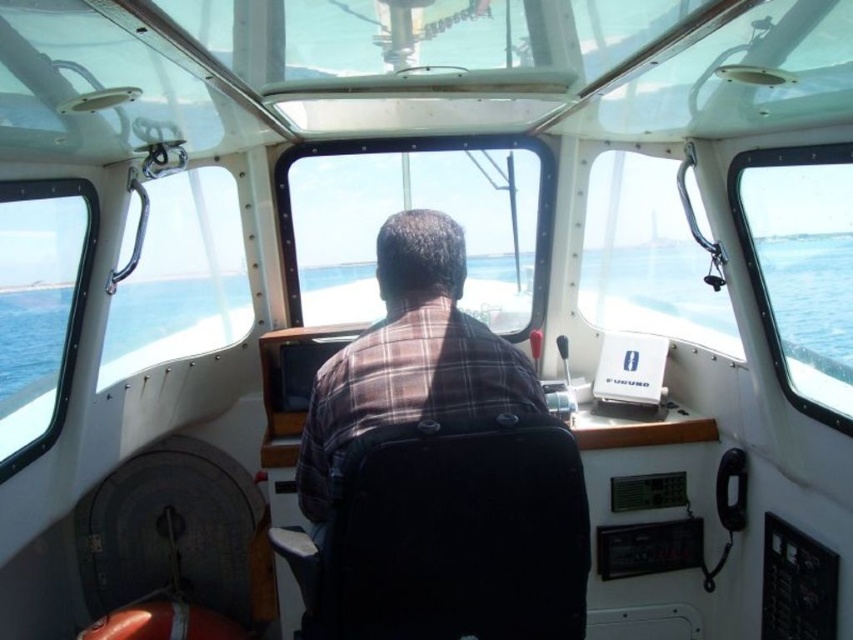
You are a passenger on the boat and want to see the ocean better. The transparent glass window at center and brown plaid shirt at center are in your view. Which object allows you to see further out into the ocean?

The transparent glass window at center allows you to see further out into the ocean because it is much taller than the brown plaid shirt at center, providing a clearer and wider view.